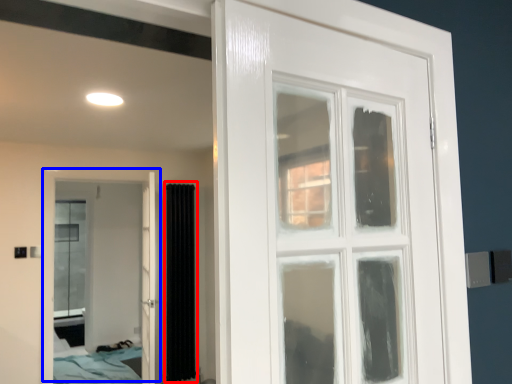
Question: Which object appears closest to the camera in this image, curtain (highlighted by a red box) or door (highlighted by a blue box)?

Choices:
 (A) curtain
 (B) door

Answer: (B)